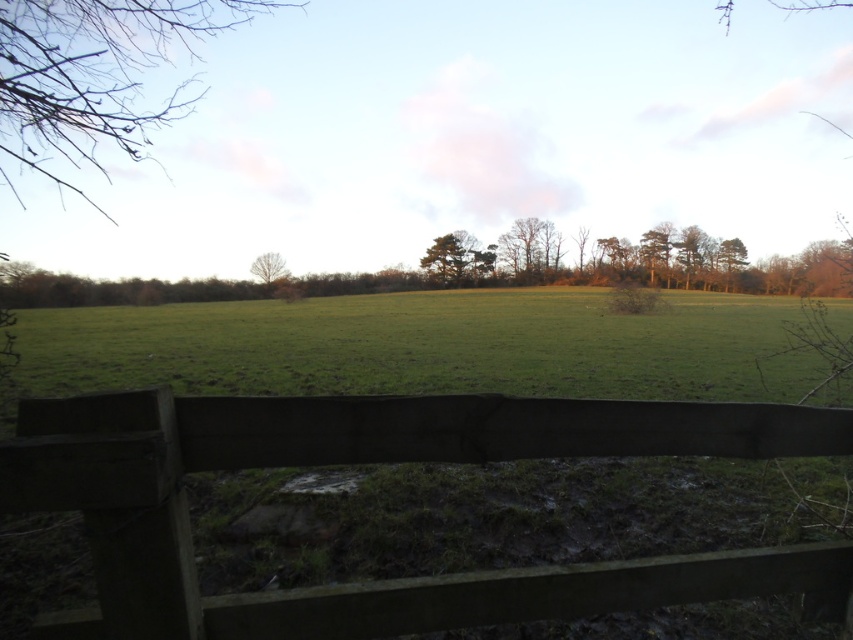
Question: Does green leafy tree at center lie behind bare branches at center?

Choices:
 (A) yes
 (B) no

Answer: (A)

Question: Which point is closer to the camera?

Choices:
 (A) (x=167, y=550)
 (B) (x=18, y=99)
 (C) (x=262, y=260)

Answer: (A)

Question: Estimate the real-world distances between objects in this image. Which object is farther from the dark brown wooden fence at lower center?

Choices:
 (A) green leafy tree at upper right
 (B) brown textured tree at center
 (C) bare branches at upper left

Answer: (A)

Question: In this image, where is bare branches at upper left located relative to green leafy tree at upper right?

Choices:
 (A) right
 (B) left

Answer: (B)

Question: Is brown textured tree at center further to camera compared to green leafy tree at upper right?

Choices:
 (A) no
 (B) yes

Answer: (A)

Question: Which of these objects is positioned closest to the bare branches at center?

Choices:
 (A) green leafy tree at upper right
 (B) green leafy tree at center
 (C) dark brown wooden fence at lower center

Answer: (B)